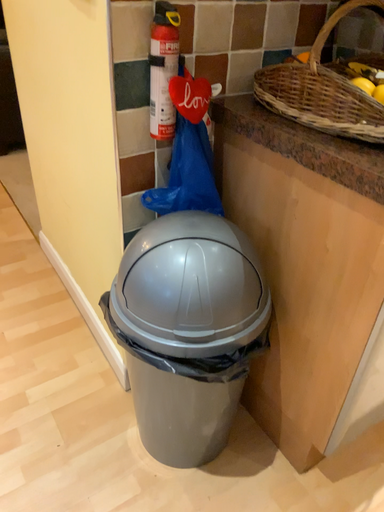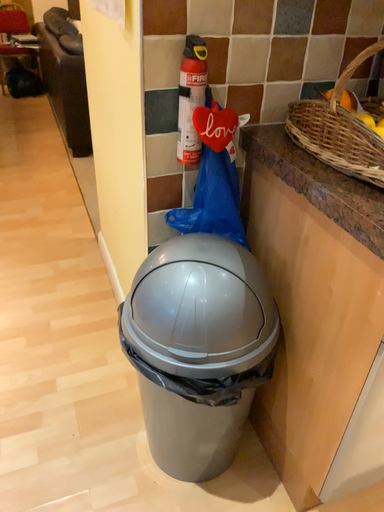
Question: Which way did the camera rotate in the video?

Choices:
 (A) rotated left
 (B) rotated right

Answer: (A)